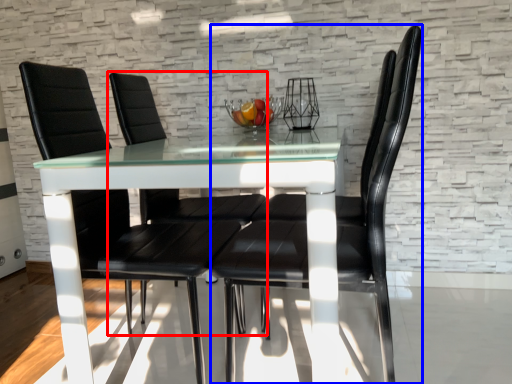
Question: Which object is closer to the camera taking this photo, chair (highlighted by a red box) or chair (highlighted by a blue box)?

Choices:
 (A) chair
 (B) chair

Answer: (B)